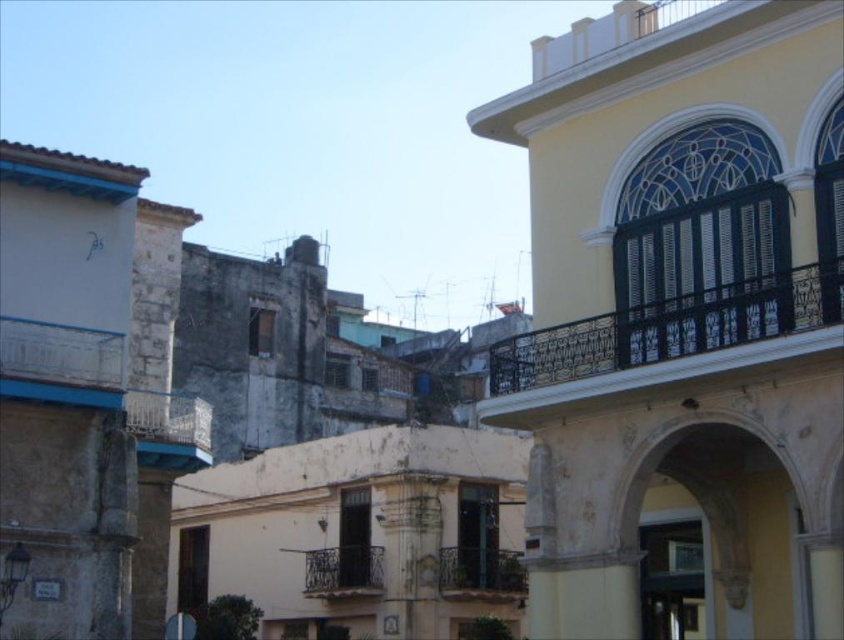
Question: Which of the following is the farthest from the observer?

Choices:
 (A) (345, 561)
 (B) (484, 572)
 (C) (625, 316)
 (D) (131, 420)

Answer: (A)

Question: Considering the relative positions of rustic wrought iron balcony at center and black wrought iron balcony at center in the image provided, where is rustic wrought iron balcony at center located with respect to black wrought iron balcony at center?

Choices:
 (A) below
 (B) above

Answer: (A)

Question: Which object is the farthest from the black wrought iron balcony at upper right?

Choices:
 (A) rustic metal balcony at center-left
 (B) rustic wrought iron balcony at center
 (C) stone archway at center

Answer: (B)

Question: Is black wrought iron balcony at upper right bigger than black wrought iron balcony at center?

Choices:
 (A) no
 (B) yes

Answer: (B)

Question: Does black wrought iron balcony at upper right appear on the right side of rustic metal balcony at center-left?

Choices:
 (A) no
 (B) yes

Answer: (B)

Question: Which object appears closest to the camera in this image?

Choices:
 (A) stone archway at center
 (B) black wrought iron balcony at upper right
 (C) rustic wrought iron balcony at center
 (D) black wrought iron balcony at center

Answer: (B)